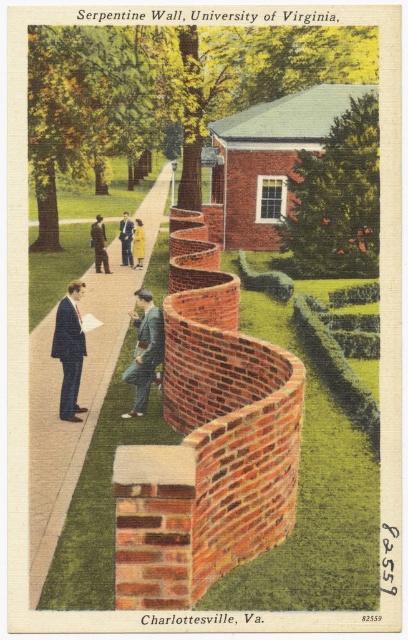
Question: Can you confirm if dark brown suit at center is smaller than yellow fabric dress at center?

Choices:
 (A) yes
 (B) no

Answer: (B)

Question: Which point is closer to the camera?

Choices:
 (A) coord(99,244)
 (B) coord(121,416)
 (C) coord(367,412)
 (D) coord(130,236)

Answer: (C)

Question: Can you confirm if smooth brick sidewalk at center is positioned above yellow fabric dress at center?

Choices:
 (A) no
 (B) yes

Answer: (B)

Question: Which object is positioned farthest from the green textured hedge at center-right?

Choices:
 (A) yellow fabric dress at center
 (B) green leafy hedge at upper center
 (C) matte black suit at left
 (D) matte gray suit at center

Answer: (A)

Question: Does matte gray suit at center have a larger size compared to yellow fabric dress at center?

Choices:
 (A) no
 (B) yes

Answer: (B)

Question: Among these points, which one is nearest to the camera?

Choices:
 (A) (323, 195)
 (B) (334, 362)

Answer: (B)